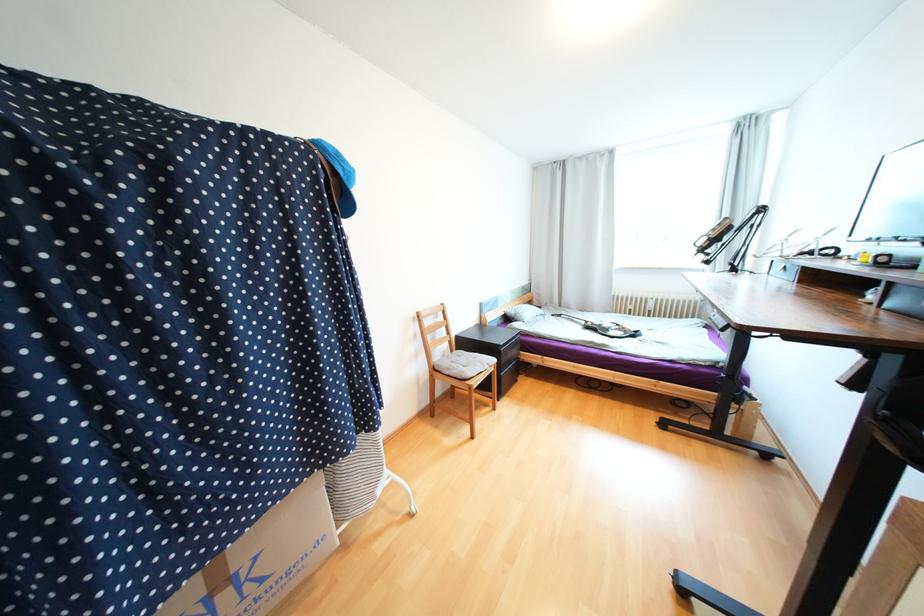
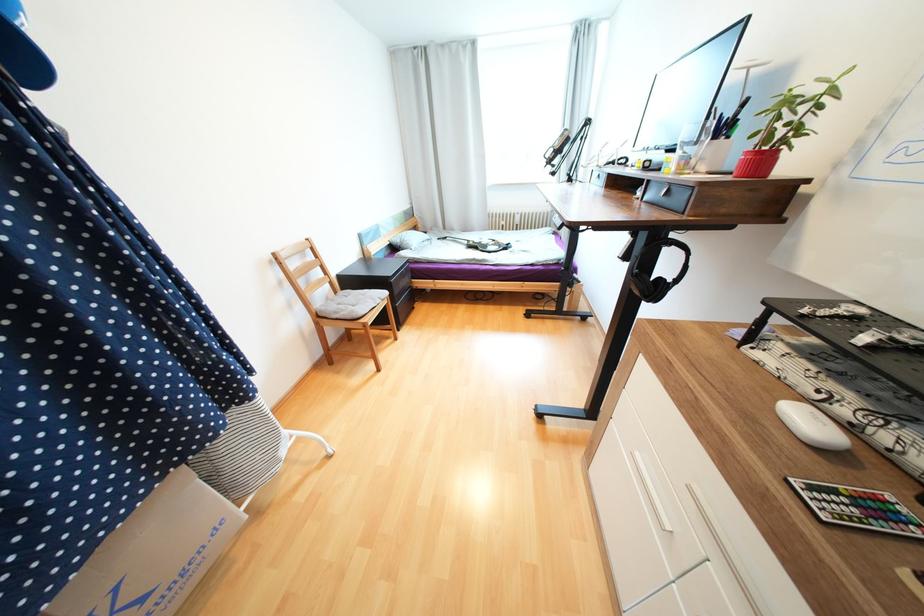
In the second image, find the point that corresponds to (590,323) in the first image.

(471, 243)